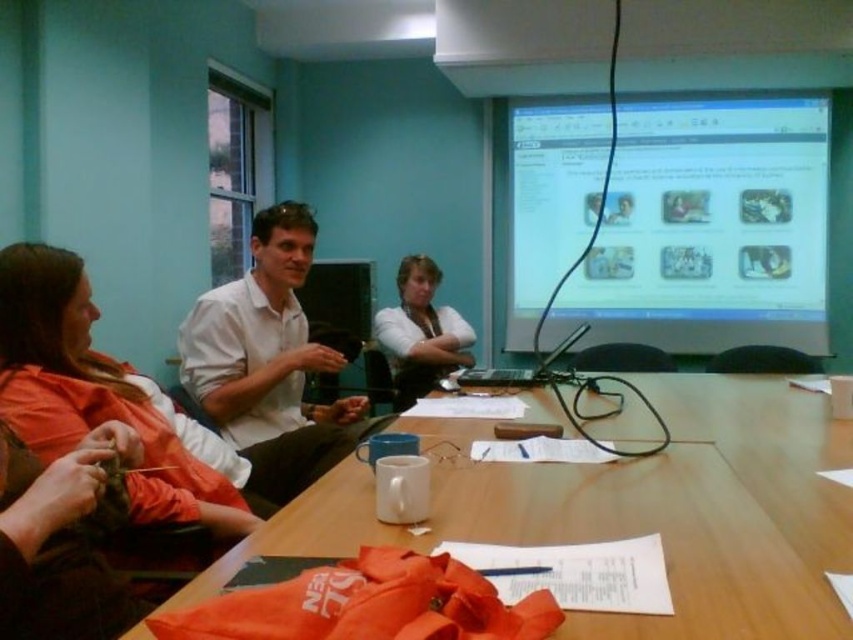
Question: Is matte white shirt at center to the left of black plastic laptop at center from the viewer's perspective?

Choices:
 (A) no
 (B) yes

Answer: (B)

Question: Does matte plastic computer screen at upper right have a greater width compared to white matte shirt at center?

Choices:
 (A) no
 (B) yes

Answer: (B)

Question: Which object appears closest to the camera in this image?

Choices:
 (A) black plastic laptop at center
 (B) wooden table at center
 (C) matte plastic computer screen at upper right
 (D) matte white shirt at center

Answer: (B)

Question: Which point is closer to the camera?

Choices:
 (A) (271, 234)
 (B) (136, 499)

Answer: (B)

Question: Which point is closer to the camera?

Choices:
 (A) white matte shirt at center
 (B) wooden table at center
 (C) black plastic laptop at center
 (D) matte plastic computer screen at upper right

Answer: (B)

Question: Can you confirm if matte plastic computer screen at upper right is positioned to the left of black plastic laptop at center?

Choices:
 (A) no
 (B) yes

Answer: (A)